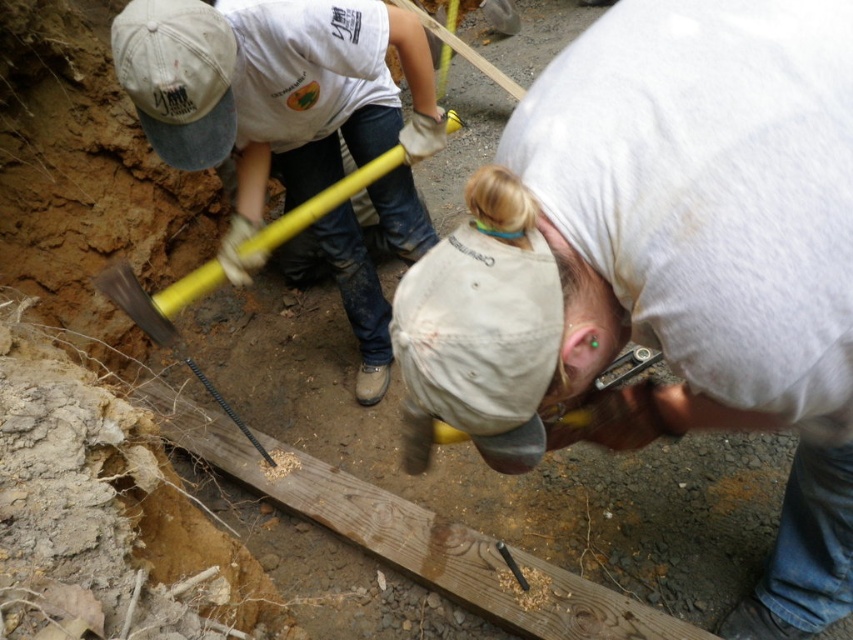
You are part of the construction team and need to locate the yellow rubber hammer at center for a task. Based on the coordinates provided, where exactly would you find it in relation to the wooden plank lying horizontally on the ground?

The yellow rubber hammer at center is located at coordinates point (282, 100), which places it near the wooden plank on the ground.

You are a construction worker who needs to reach the yellow rubber hammer at center and the yellow metal shovel at lower left. If you are standing at the wooden plank, which tool is closer to you?

The yellow rubber hammer at center is 49.60 centimeters away from the yellow metal shovel at lower left. Since you are standing at the wooden plank, the distance between you and each tool depends on their positions relative to the plank. However, the description only provides the distance between the two tools, not their distance from the plank. Therefore, it is impossible to determine which tool is closer to you based on the given information.